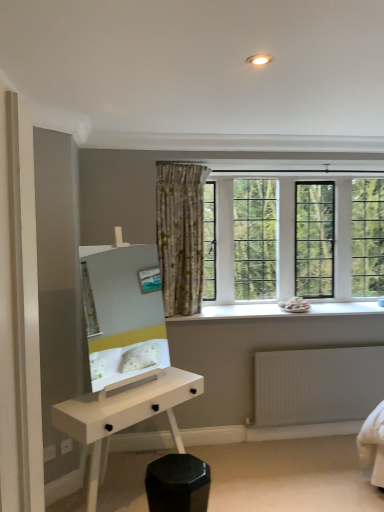
Question: Is the position of white glossy mirror at center less distant than that of white glossy desk at lower center?

Choices:
 (A) yes
 (B) no

Answer: (B)

Question: From the image's perspective, is white glossy mirror at center located beneath white glossy desk at lower center?

Choices:
 (A) no
 (B) yes

Answer: (A)

Question: Considering the relative sizes of white glossy mirror at center and white glossy desk at lower center in the image provided, is white glossy mirror at center smaller than white glossy desk at lower center?

Choices:
 (A) no
 (B) yes

Answer: (B)

Question: Is the depth of white glossy mirror at center greater than that of white glossy desk at lower center?

Choices:
 (A) yes
 (B) no

Answer: (A)

Question: Does white glossy mirror at center appear on the right side of white glossy desk at lower center?

Choices:
 (A) yes
 (B) no

Answer: (B)

Question: From a real-world perspective, is white glossy mirror at center beneath white glossy desk at lower center?

Choices:
 (A) yes
 (B) no

Answer: (B)

Question: Is the depth of black matte hexagonal stool at lower center less than that of clear glass windows at upper center?

Choices:
 (A) no
 (B) yes

Answer: (B)

Question: Does black matte hexagonal stool at lower center have a greater width compared to clear glass windows at upper center?

Choices:
 (A) yes
 (B) no

Answer: (A)

Question: Considering the relative sizes of black matte hexagonal stool at lower center and clear glass windows at upper center in the image provided, is black matte hexagonal stool at lower center taller than clear glass windows at upper center?

Choices:
 (A) yes
 (B) no

Answer: (B)

Question: Does black matte hexagonal stool at lower center have a larger size compared to clear glass windows at upper center?

Choices:
 (A) no
 (B) yes

Answer: (A)

Question: Does black matte hexagonal stool at lower center have a smaller size compared to clear glass windows at upper center?

Choices:
 (A) no
 (B) yes

Answer: (B)

Question: Is black matte hexagonal stool at lower center positioned beyond the bounds of clear glass windows at upper center?

Choices:
 (A) yes
 (B) no

Answer: (A)

Question: Could you tell me if black matte hexagonal stool at lower center is facing white stone window sill at center?

Choices:
 (A) no
 (B) yes

Answer: (A)